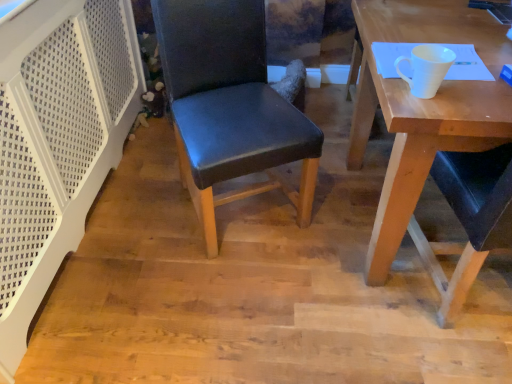
At what (x,y) coordinates should I click in order to perform the action: click on vacant space positioned to the left of black leather chair at center. Please return your answer as a coordinate pair (x, y). The image size is (512, 384). Looking at the image, I should click on (143, 209).